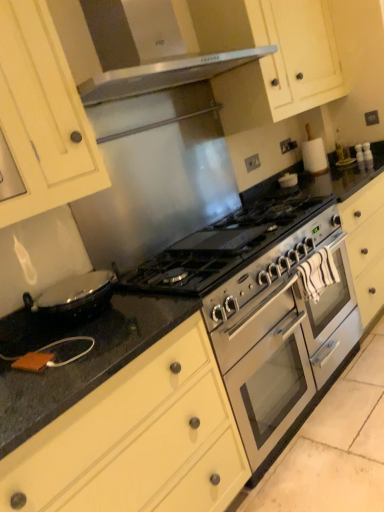
Question: Is stainless steel gas stove at center wider or thinner than matte cream drawer at lower left, positioned as the 1th cabinetry in bottom-to-top order?

Choices:
 (A) thin
 (B) wide

Answer: (A)

Question: Looking at the image, does stainless steel gas stove at center seem bigger or smaller compared to matte cream drawer at lower left, positioned as the 1th cabinetry in bottom-to-top order?

Choices:
 (A) small
 (B) big

Answer: (A)

Question: Considering the real-world distances, which object is closest to the matte white cabinet at upper left, positioned as the 2th cabinetry in top-to-bottom order?

Choices:
 (A) stainless steel gas stove at center
 (B) matte cream cabinet at upper center, placed as the third cabinetry when sorted from bottom to top
 (C) matte cream drawer at lower left, positioned as the 1th cabinetry in bottom-to-top order
 (D) stainless steel oven at center

Answer: (A)

Question: Based on their relative distances, which object is nearer to the stainless steel oven at center?

Choices:
 (A) stainless steel gas stove at center
 (B) matte white cabinet at upper left, positioned as the 2th cabinetry in top-to-bottom order
 (C) matte cream cabinet at upper center, acting as the 1th cabinetry starting from the top
 (D) matte cream drawer at lower left, placed as the 3th cabinetry when sorted from top to bottom

Answer: (A)